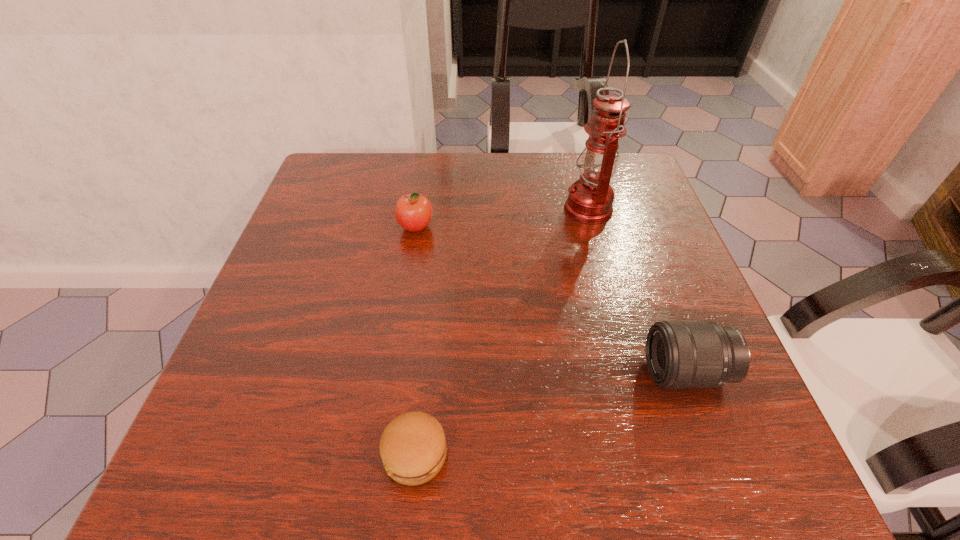
I want to click on free location located on the right of the hamburger, so click(x=494, y=454).

The width and height of the screenshot is (960, 540). In order to click on object at the far edge in this screenshot , I will do `click(590, 200)`.

The width and height of the screenshot is (960, 540). What are the coordinates of `object situated at the near edge` in the screenshot? It's located at (413, 449).

Find the location of a particular element. oil lamp present at the right edge is located at coordinates (590, 200).

In order to click on telephoto lens at the right edge in this screenshot , I will do `click(680, 354)`.

Where is `object present at the far right corner`? object present at the far right corner is located at coordinates (590, 200).

You are a GUI agent. You are given a task and a screenshot of the screen. Output one action in this format:
    pyautogui.click(x=<x>, y=<y>)
    Task: Click on the free spot at the far edge of the desktop
    
    Given the screenshot: What is the action you would take?
    pyautogui.click(x=565, y=189)

Find the location of a particular element. The image size is (960, 540). vacant space at the near edge of the desktop is located at coordinates (376, 488).

In the image, there is a desktop. Where is `blank space at the left edge`? This screenshot has width=960, height=540. blank space at the left edge is located at coordinates (348, 219).

In the image, there is a desktop. In order to click on free region at the right edge in this screenshot , I will do `click(707, 430)`.